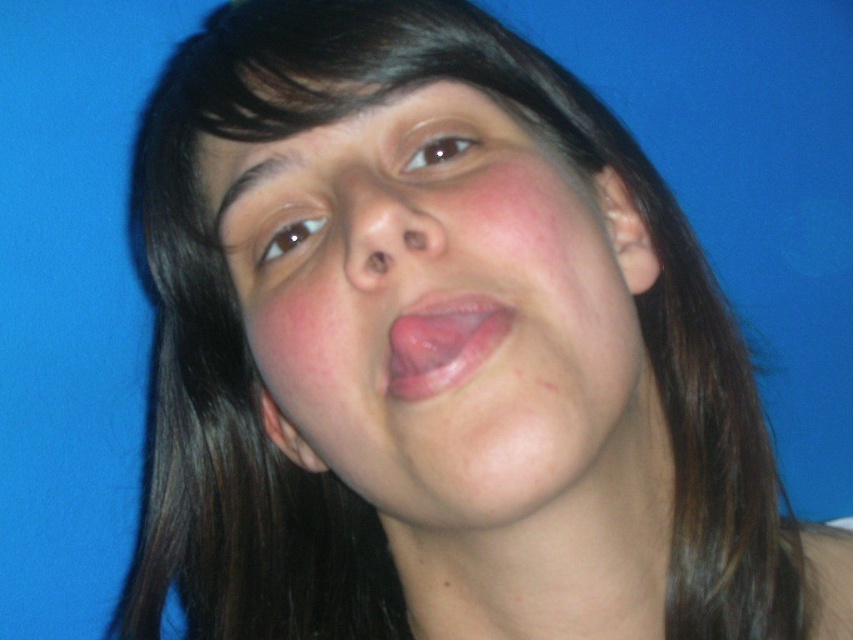
In the scene shown: Based on the image description, which object is wider between the smooth skin nose at center and the pink flesh at center?

The smooth skin nose at center is wider than the pink flesh at center according to the description.

Consider the image. Looking at the person in the image, which of the two features at the center is bigger? The smooth skin nose at center or the pink flesh at center?

The smooth skin nose at center has a larger size compared to the pink flesh at center.